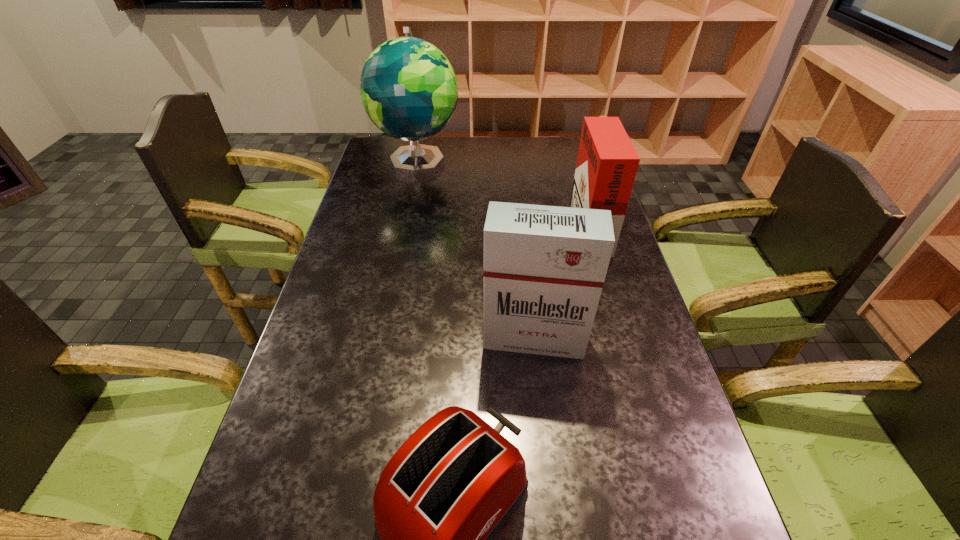
Where is `the farthest object`? the farthest object is located at coordinates (409, 90).

At what (x,y) coordinates should I click in order to perform the action: click on the tallest object. Please return your answer as a coordinate pair (x, y). This screenshot has width=960, height=540. Looking at the image, I should click on (409, 90).

Identify the location of the nearer cigarette case. (544, 267).

I want to click on the second nearest object, so click(x=544, y=267).

This screenshot has width=960, height=540. What are the coordinates of `the rightmost object` in the screenshot? It's located at (x=607, y=163).

I want to click on the third nearest object, so click(607, 163).

Image resolution: width=960 pixels, height=540 pixels. I want to click on free space located 0.390m on the front surface of the globe, so click(398, 260).

Where is `vacant space situated 0.400m on the back of the nearer cigarette case`? This screenshot has width=960, height=540. vacant space situated 0.400m on the back of the nearer cigarette case is located at coordinates (521, 223).

The image size is (960, 540). I want to click on vacant position located 0.060m on the front-facing side of the right cigarette case, so click(554, 226).

Where is `vacant space situated 0.110m on the front-facing side of the right cigarette case`? The image size is (960, 540). vacant space situated 0.110m on the front-facing side of the right cigarette case is located at coordinates (539, 226).